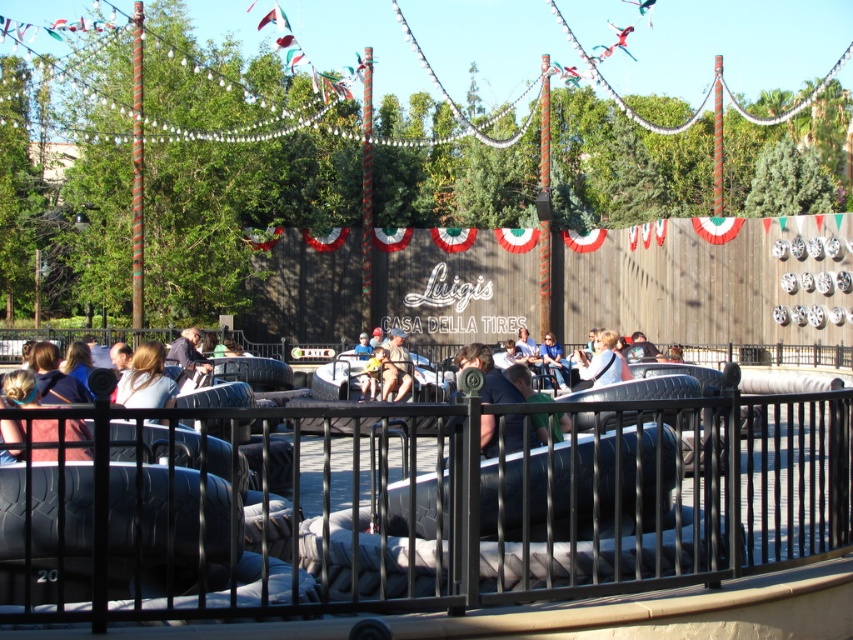
Question: Can you confirm if blonde hair at center is positioned below light blue shirt at center?

Choices:
 (A) no
 (B) yes

Answer: (A)

Question: Considering the relative positions of blonde hair at center and light blue denim jeans at center in the image provided, where is blonde hair at center located with respect to light blue denim jeans at center?

Choices:
 (A) left
 (B) right

Answer: (A)

Question: Which point appears farthest from the camera in this image?

Choices:
 (A) (550, 339)
 (B) (395, 468)
 (C) (614, 376)

Answer: (A)

Question: Which point is farther to the camera?

Choices:
 (A) black metal fence at center
 (B) light blue shirt at center
 (C) light blue denim jeans at center
 (D) blonde hair at center

Answer: (C)

Question: Does blonde hair at center appear over light blue denim jeans at center?

Choices:
 (A) yes
 (B) no

Answer: (A)

Question: Among these points, which one is nearest to the camera?

Choices:
 (A) (614, 369)
 (B) (9, 512)
 (C) (549, 332)

Answer: (B)